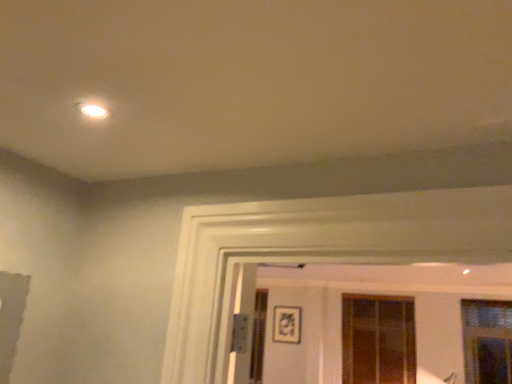
Question: Considering the relative positions of clear glass window at right, which is counted as the 1th window, starting from the right, and translucent glass window at center, which ranks as the first window in left-to-right order, in the image provided, is clear glass window at right, which is counted as the 1th window, starting from the right, to the left of translucent glass window at center, which ranks as the first window in left-to-right order, from the viewer's perspective?

Choices:
 (A) yes
 (B) no

Answer: (B)

Question: Can you confirm if clear glass window at right, which is counted as the 1th window, starting from the right, is shorter than translucent glass window at center, the second window viewed from the front?

Choices:
 (A) no
 (B) yes

Answer: (B)

Question: Is clear glass window at right, the first window viewed from the front, turned away from translucent glass window at center, which ranks as the first window in left-to-right order?

Choices:
 (A) no
 (B) yes

Answer: (A)

Question: Can you confirm if clear glass window at right, the first window viewed from the front, is bigger than translucent glass window at center, the second window viewed from the front?

Choices:
 (A) yes
 (B) no

Answer: (B)

Question: Could you tell me if clear glass window at right, arranged as the 2th window when viewed from the back, is turned towards translucent glass window at center, the second window viewed from the front?

Choices:
 (A) yes
 (B) no

Answer: (B)

Question: Is clear glass window at right, the 2th window from the left, positioned far away from translucent glass window at center, arranged as the first window when viewed from the back?

Choices:
 (A) no
 (B) yes

Answer: (A)

Question: Is translucent glass window at center, the second window viewed from the front, directly adjacent to matte black picture frame at center?

Choices:
 (A) no
 (B) yes

Answer: (A)

Question: Is translucent glass window at center, arranged as the first window when viewed from the back, taller than matte black picture frame at center?

Choices:
 (A) no
 (B) yes

Answer: (B)

Question: Is translucent glass window at center, the second window viewed from the front, positioned beyond the bounds of matte black picture frame at center?

Choices:
 (A) yes
 (B) no

Answer: (A)

Question: Can you confirm if translucent glass window at center, which ranks as the first window in left-to-right order, is positioned to the left of matte black picture frame at center?

Choices:
 (A) yes
 (B) no

Answer: (B)

Question: From the image's perspective, does translucent glass window at center, which ranks as the first window in left-to-right order, appear lower than matte black picture frame at center?

Choices:
 (A) yes
 (B) no

Answer: (A)

Question: Is translucent glass window at center, which ranks as the first window in left-to-right order, at the right side of matte black picture frame at center?

Choices:
 (A) no
 (B) yes

Answer: (B)

Question: From a real-world perspective, is matte black picture frame at center positioned over clear glass window at right, which is counted as the 1th window, starting from the right, based on gravity?

Choices:
 (A) no
 (B) yes

Answer: (B)